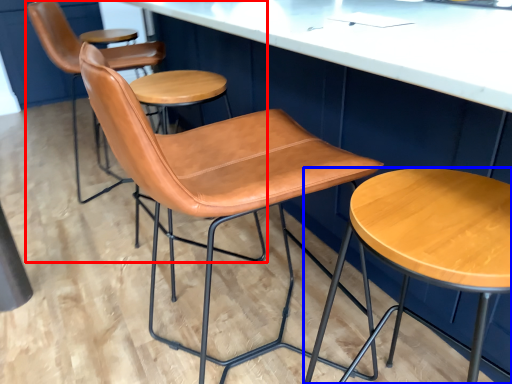
Question: Which point is closer to the camera, chair (highlighted by a red box) or stool (highlighted by a blue box)?

Choices:
 (A) chair
 (B) stool

Answer: (B)